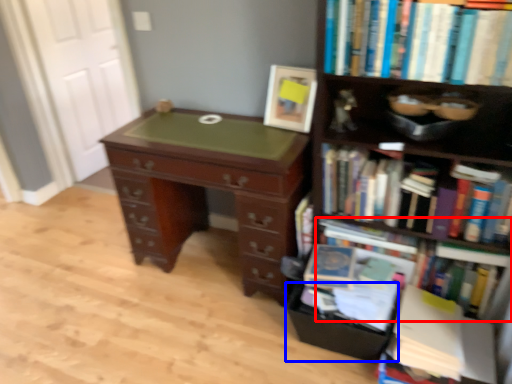
Question: Which object appears farthest to the camera in this image, book (highlighted by a red box) or drawer (highlighted by a blue box)?

Choices:
 (A) book
 (B) drawer

Answer: (B)